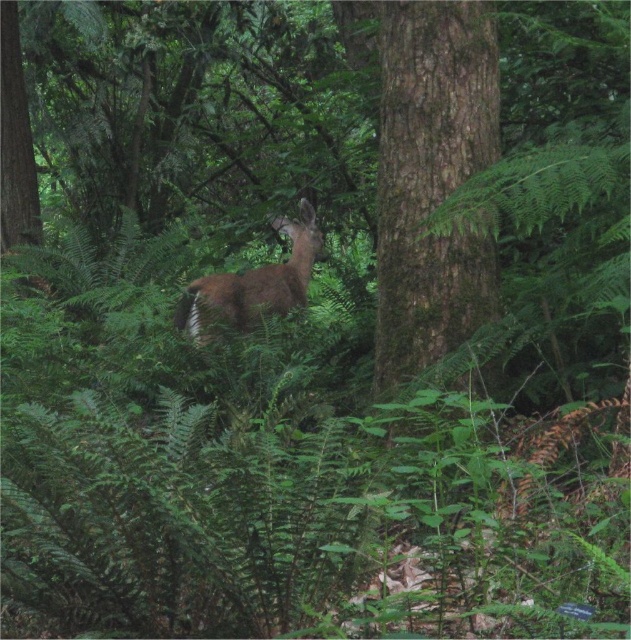
Who is lower down, brown rough bark tree at center or brown furry deer at center?

brown furry deer at center

Is brown rough bark tree at center closer to the viewer compared to brown furry deer at center?

That is True.

Identify the location of brown rough bark tree at center. (427, 172).